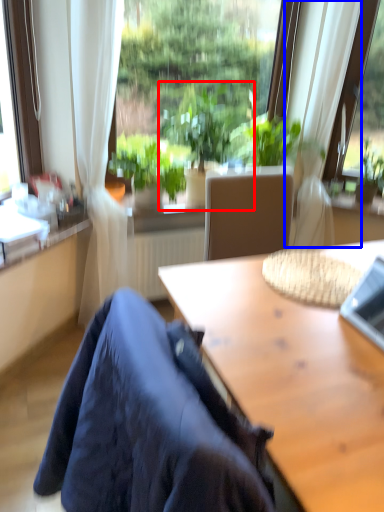
Question: Among these objects, which one is farthest to the camera, houseplant (highlighted by a red box) or curtain (highlighted by a blue box)?

Choices:
 (A) houseplant
 (B) curtain

Answer: (A)